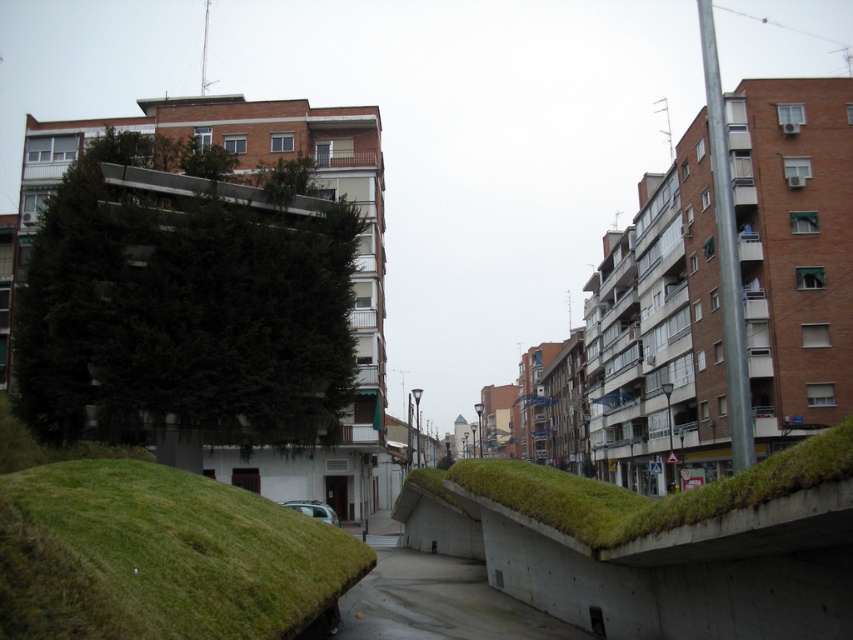
Question: Does green grassy mound at center have a larger size compared to silver metallic car at center?

Choices:
 (A) no
 (B) yes

Answer: (A)

Question: Which object is positioned closest to the green grassy mound at center?

Choices:
 (A) concrete at center
 (B) silver metallic car at center

Answer: (A)

Question: Is green grassy mound at center positioned in front of silver metallic car at center?

Choices:
 (A) yes
 (B) no

Answer: (A)

Question: Among these objects, which one is farthest from the camera?

Choices:
 (A) silver metallic car at center
 (B) green grassy mound at center
 (C) concrete at center

Answer: (A)

Question: Which of these objects is positioned closest to the green grassy mound at center?

Choices:
 (A) concrete at center
 (B) silver metallic car at center

Answer: (A)

Question: Can you confirm if green grassy mound at center is bigger than concrete at center?

Choices:
 (A) no
 (B) yes

Answer: (A)